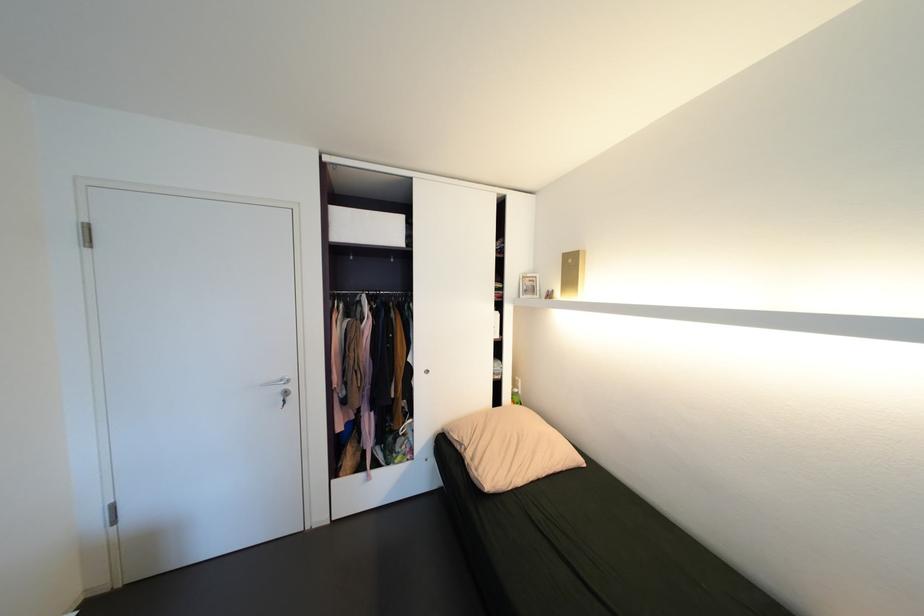
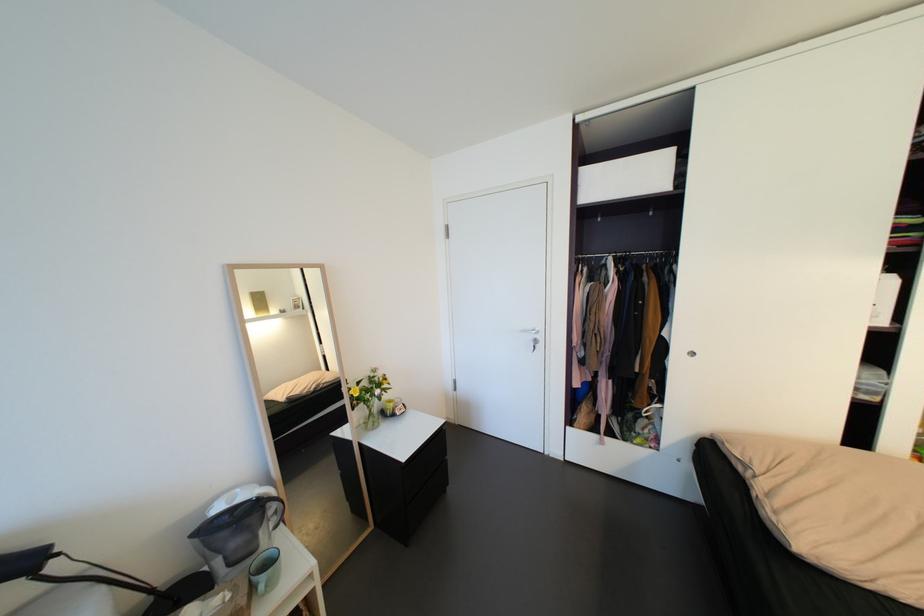
Question: I am providing you with two images of the same scene from different viewpoints. Which of the following objects are not visible in image2?

Choices:
 (A) metal clothing rail
 (B) light blue mug
 (C) black drawer
 (D) none of these

Answer: (D)